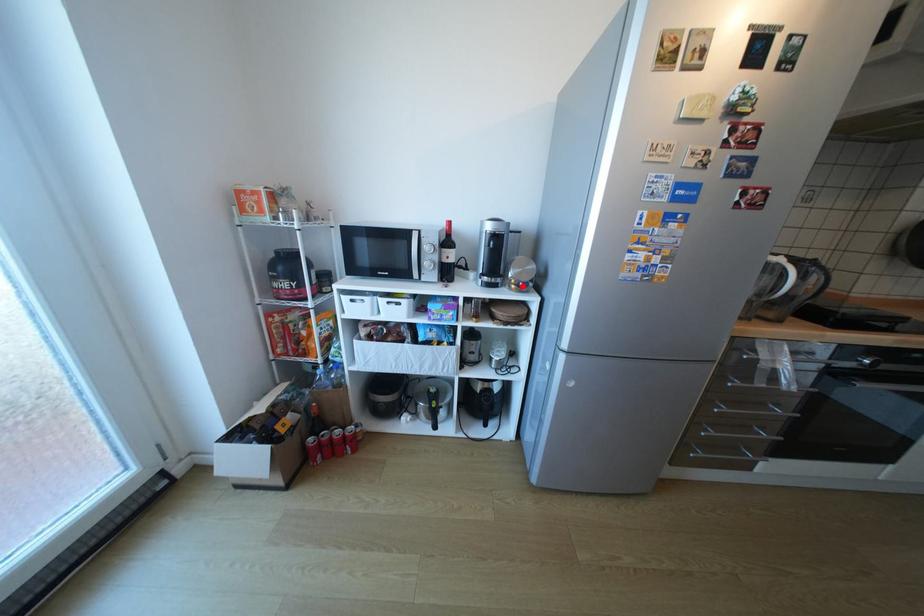
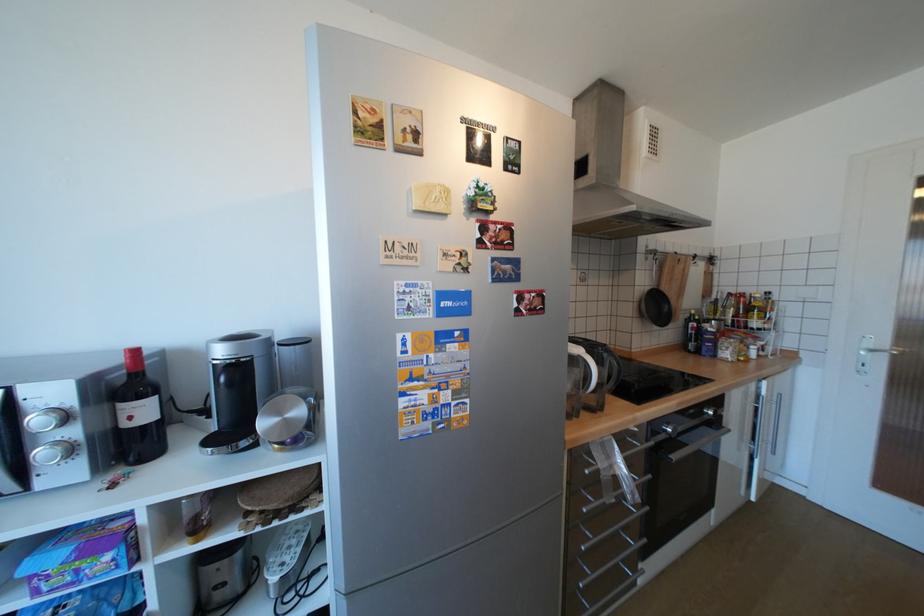
Question: I am providing you with two images of the same scene from different viewpoints. A red point is shown in image1. For the corresponding object point in image2, is it positioned nearer or farther from the camera?

Choices:
 (A) Nearer
 (B) Farther

Answer: (B)